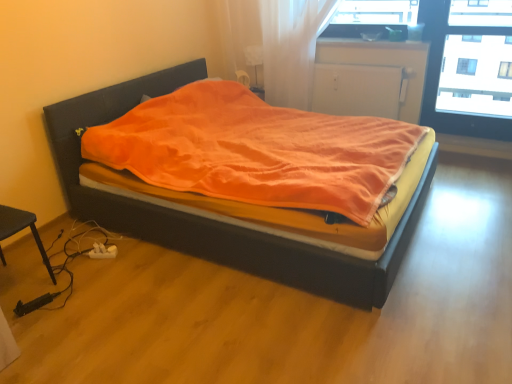
This screenshot has height=384, width=512. I want to click on vacant area on top of smooth wood window sill at right (from a real-world perspective), so click(479, 138).